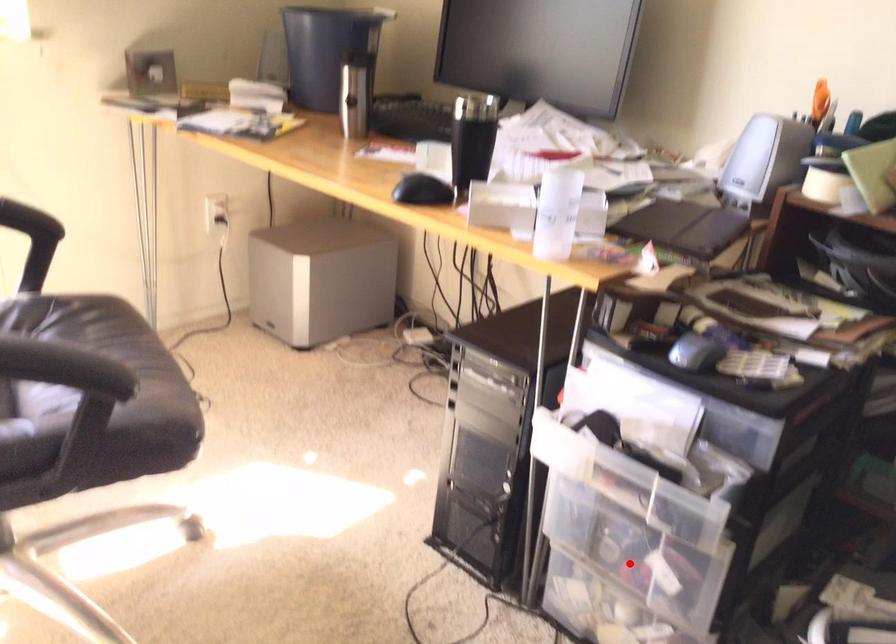
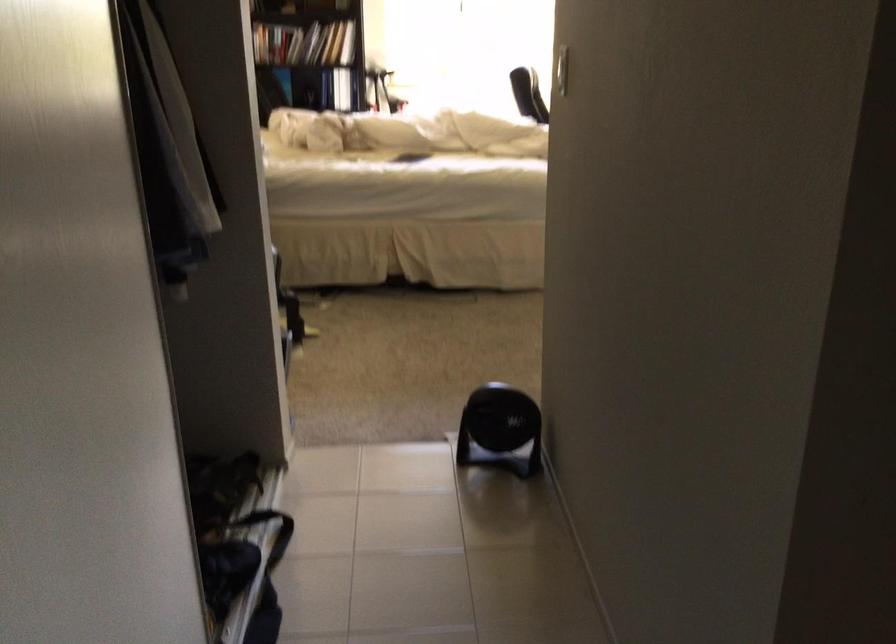
Question: I am providing you with two images of the same scene from different viewpoints. A red point is marked on the first image. Can you still see the location of the red point in image 2?

Choices:
 (A) Yes
 (B) No

Answer: (B)